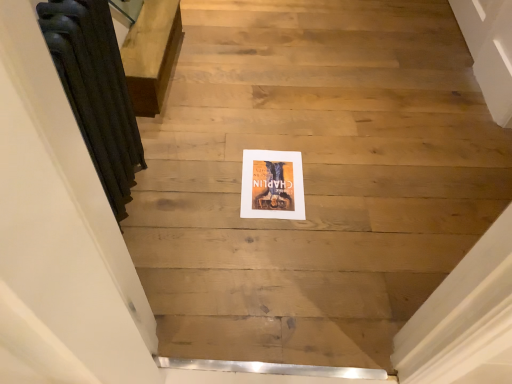
Describe the element at coordinates (96, 91) in the screenshot. I see `dark gray cast iron radiator at left` at that location.

I want to click on dark gray cast iron radiator at left, so click(96, 91).

The height and width of the screenshot is (384, 512). I want to click on white matte picture frame at center, so click(272, 185).

Describe the element at coordinates (272, 185) in the screenshot. This screenshot has width=512, height=384. I see `white matte picture frame at center` at that location.

Where is `dark gray cast iron radiator at left`? The image size is (512, 384). dark gray cast iron radiator at left is located at coordinates (96, 91).

Can you confirm if white matte picture frame at center is positioned to the right of dark gray cast iron radiator at left?

Yes, white matte picture frame at center is to the right of dark gray cast iron radiator at left.

Considering the positions of objects white matte picture frame at center and dark gray cast iron radiator at left in the image provided, who is behind, white matte picture frame at center or dark gray cast iron radiator at left?

white matte picture frame at center is behind.

Considering the positions of points (253, 212) and (88, 80), is point (253, 212) closer to camera compared to point (88, 80)?

No, (253, 212) is further to viewer.

From the image's perspective, is white matte picture frame at center located beneath dark gray cast iron radiator at left?

Yes, from the image's perspective, white matte picture frame at center is beneath dark gray cast iron radiator at left.

From a real-world perspective, is white matte picture frame at center located higher than dark gray cast iron radiator at left?

Actually, white matte picture frame at center is physically below dark gray cast iron radiator at left in the real world.

Does white matte picture frame at center have a lesser width compared to dark gray cast iron radiator at left?

In fact, white matte picture frame at center might be wider than dark gray cast iron radiator at left.

Based on the photo, does white matte picture frame at center have a lesser height compared to dark gray cast iron radiator at left?

Indeed, white matte picture frame at center has a lesser height compared to dark gray cast iron radiator at left.

Does white matte picture frame at center have a larger size compared to dark gray cast iron radiator at left?

Actually, white matte picture frame at center might be smaller than dark gray cast iron radiator at left.

Choose the correct answer: Is white matte picture frame at center inside dark gray cast iron radiator at left or outside it?

white matte picture frame at center is outside dark gray cast iron radiator at left.

From the picture: Are white matte picture frame at center and dark gray cast iron radiator at left located far from each other?

No, white matte picture frame at center is not far away from dark gray cast iron radiator at left.

Is white matte picture frame at center turned away from dark gray cast iron radiator at left?

No.

How many degrees apart are the facing directions of white matte picture frame at center and dark gray cast iron radiator at left?

They differ by 89.4 degrees in their facing directions.

Find the location of a particular element. This screenshot has height=384, width=512. radiator above the white matte picture frame at center (from the image's perspective) is located at coordinates (96, 91).

Is dark gray cast iron radiator at left to the left or to the right of white matte picture frame at center in the image?

Based on their positions, dark gray cast iron radiator at left is located to the left of white matte picture frame at center.

Does dark gray cast iron radiator at left lie in front of white matte picture frame at center?

Yes, it is.

Is point (79, 114) positioned before point (301, 215)?

That is True.

From the image's perspective, is dark gray cast iron radiator at left located above white matte picture frame at center?

Yes.

From a real-world perspective, between dark gray cast iron radiator at left and white matte picture frame at center, who is vertically lower?

In real-world perspective, white matte picture frame at center is lower.

Considering the sizes of objects dark gray cast iron radiator at left and white matte picture frame at center in the image provided, who is wider, dark gray cast iron radiator at left or white matte picture frame at center?

white matte picture frame at center.

From the picture: Is dark gray cast iron radiator at left taller than white matte picture frame at center?

Yes, dark gray cast iron radiator at left is taller than white matte picture frame at center.

Which of these two, dark gray cast iron radiator at left or white matte picture frame at center, is bigger?

dark gray cast iron radiator at left is bigger.

Can white matte picture frame at center be found inside dark gray cast iron radiator at left?

That's incorrect, white matte picture frame at center is not inside dark gray cast iron radiator at left.

Can you see dark gray cast iron radiator at left touching white matte picture frame at center?

No, dark gray cast iron radiator at left is not with white matte picture frame at center.

Is dark gray cast iron radiator at left looking in the opposite direction of white matte picture frame at center?

No, dark gray cast iron radiator at left is not facing the opposite direction of white matte picture frame at center.

The height and width of the screenshot is (384, 512). I want to click on picture frame behind the dark gray cast iron radiator at left, so click(x=272, y=185).

This screenshot has height=384, width=512. What are the coordinates of `picture frame below the dark gray cast iron radiator at left (from a real-world perspective)` in the screenshot? It's located at (272, 185).

The height and width of the screenshot is (384, 512). Find the location of `radiator in front of the white matte picture frame at center`. radiator in front of the white matte picture frame at center is located at coordinates [96, 91].